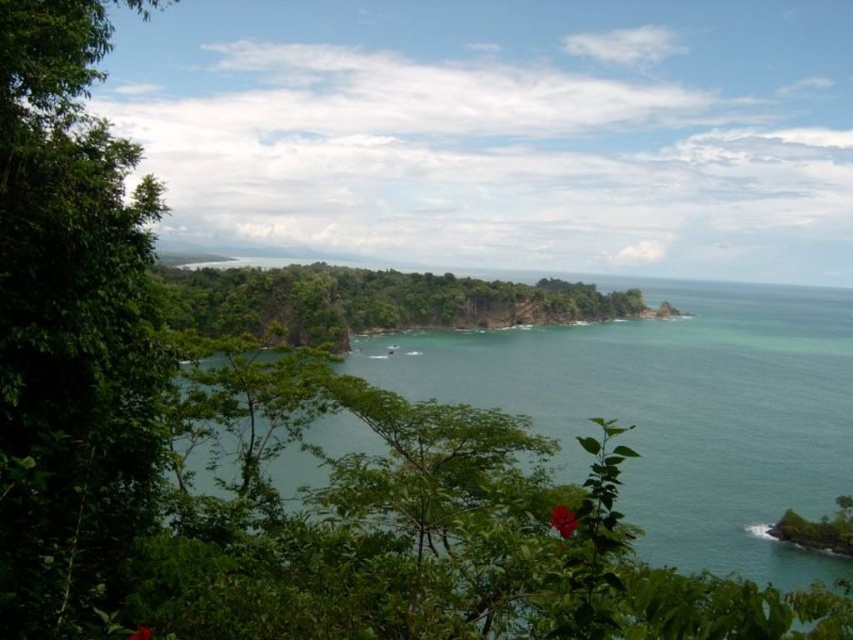
Question: Which of the following is the closest to the observer?

Choices:
 (A) (210, 296)
 (B) (701, 509)
 (C) (6, 163)

Answer: (C)

Question: Can you confirm if green leafy tree at left is positioned to the left of green glossy water at center?

Choices:
 (A) yes
 (B) no

Answer: (A)

Question: Is green leafy tree at left smaller than green leafy forest at center?

Choices:
 (A) no
 (B) yes

Answer: (B)

Question: Which point is closer to the camera taking this photo?

Choices:
 (A) (144, 436)
 (B) (445, 301)
 (C) (581, 428)

Answer: (A)

Question: Which of the following is the closest to the observer?

Choices:
 (A) (67, 461)
 (B) (399, 387)
 (C) (323, 342)

Answer: (A)

Question: Does green glossy water at center have a greater width compared to green leafy forest at center?

Choices:
 (A) yes
 (B) no

Answer: (A)